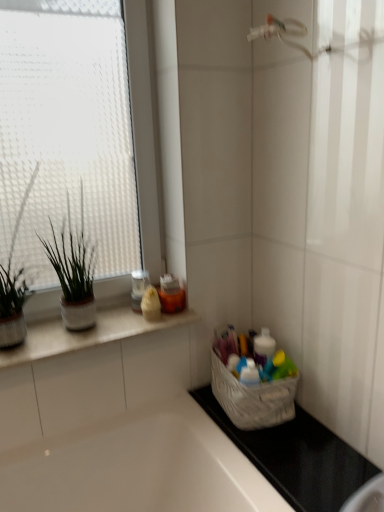
Question: Is point 304,502 closer or farther from the camera than point 79,230?

Choices:
 (A) farther
 (B) closer

Answer: (B)

Question: Considering the positions of black rubber mat at lower right and green matte plant at left, which is counted as the second houseplant, starting from the left, in the image, is black rubber mat at lower right wider or thinner than green matte plant at left, which is counted as the second houseplant, starting from the left,?

Choices:
 (A) wide
 (B) thin

Answer: (A)

Question: Which object is the farthest from the black rubber mat at lower right?

Choices:
 (A) green matte plant at left, which is counted as the second houseplant, starting from the left
 (B) green matte plant at left, which is the second houseplant from right to left
 (C) transparent glass window at upper left
 (D) white fabric basket at lower right
 (E) white ceramic countertop at upper left

Answer: (C)

Question: Which object is the farthest from the black rubber mat at lower right?

Choices:
 (A) green matte plant at left, which ranks as the 1th houseplant in right-to-left order
 (B) transparent glass window at upper left
 (C) white ceramic countertop at upper left
 (D) green matte plant at left, which is the second houseplant from right to left
 (E) white glossy bathtub at lower left

Answer: (B)